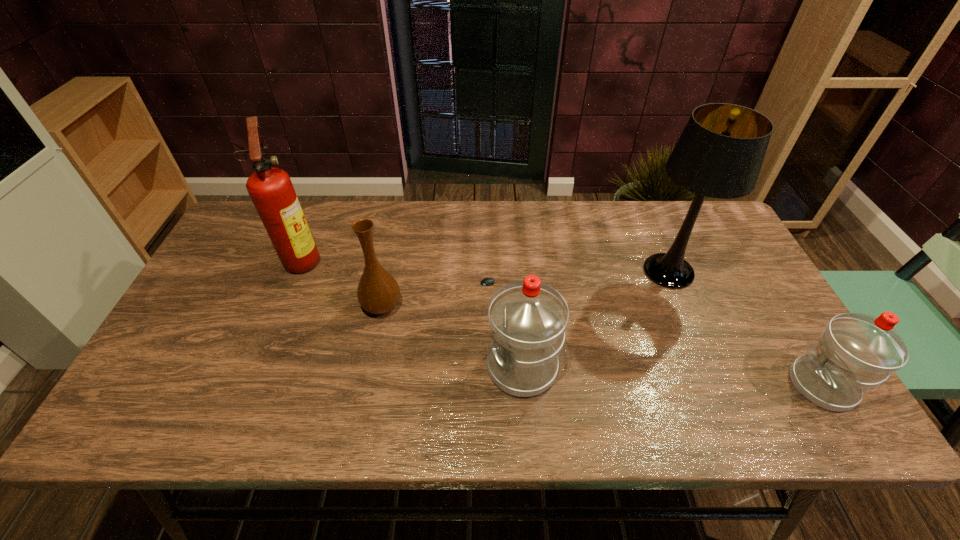
Locate an element on the screen. The height and width of the screenshot is (540, 960). table lamp situated at the right edge is located at coordinates click(x=720, y=152).

Image resolution: width=960 pixels, height=540 pixels. Identify the location of object located at the far right corner. (720, 152).

Identify the location of object present at the near right corner. (856, 352).

Where is `vacant space at the far edge`? Image resolution: width=960 pixels, height=540 pixels. vacant space at the far edge is located at coordinates pyautogui.click(x=442, y=225).

I want to click on vacant space at the near edge of the desktop, so click(300, 392).

In the image, there is a desktop. Where is `vacant space at the right edge`? vacant space at the right edge is located at coordinates (732, 326).

In the image, there is a desktop. Find the location of `vacant space at the far left corner`. vacant space at the far left corner is located at coordinates (250, 230).

At what (x,y) coordinates should I click in order to perform the action: click on vacant space at the near left corner of the desktop. Please return your answer as a coordinate pair (x, y). Looking at the image, I should click on (216, 370).

Locate an element on the screen. The height and width of the screenshot is (540, 960). free space at the near right corner is located at coordinates (788, 366).

Find the location of a particular element. The height and width of the screenshot is (540, 960). vacant region between the shortest object and the shorter water bottle is located at coordinates (660, 334).